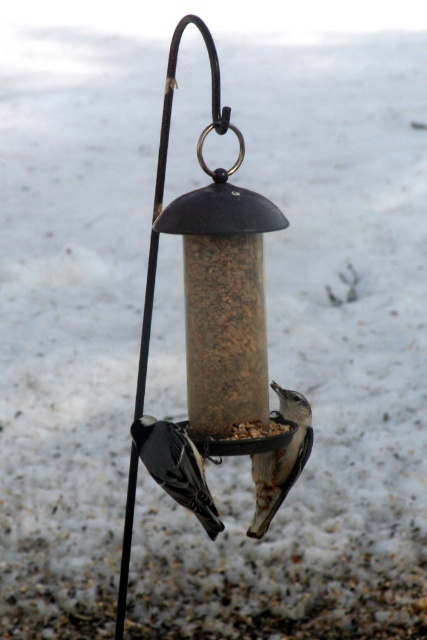
Question: Which point is closer to the camera?

Choices:
 (A) black matte bird at lower left
 (B) white speckled bird at center

Answer: (A)

Question: Which of the following is the closest to the observer?

Choices:
 (A) white speckled bird at center
 (B) black matte bird at lower left

Answer: (B)

Question: Does black matte bird at lower left have a greater width compared to white speckled bird at center?

Choices:
 (A) no
 (B) yes

Answer: (B)

Question: Is the position of black matte bird at lower left less distant than that of white speckled bird at center?

Choices:
 (A) no
 (B) yes

Answer: (B)

Question: Is black matte bird at lower left positioned behind white speckled bird at center?

Choices:
 (A) no
 (B) yes

Answer: (A)